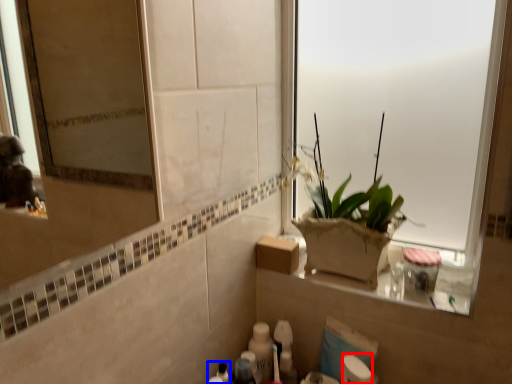
Question: Which object appears closest to the camera in this image, toilet paper (highlighted by a red box) or toiletry (highlighted by a blue box)?

Choices:
 (A) toilet paper
 (B) toiletry

Answer: (A)